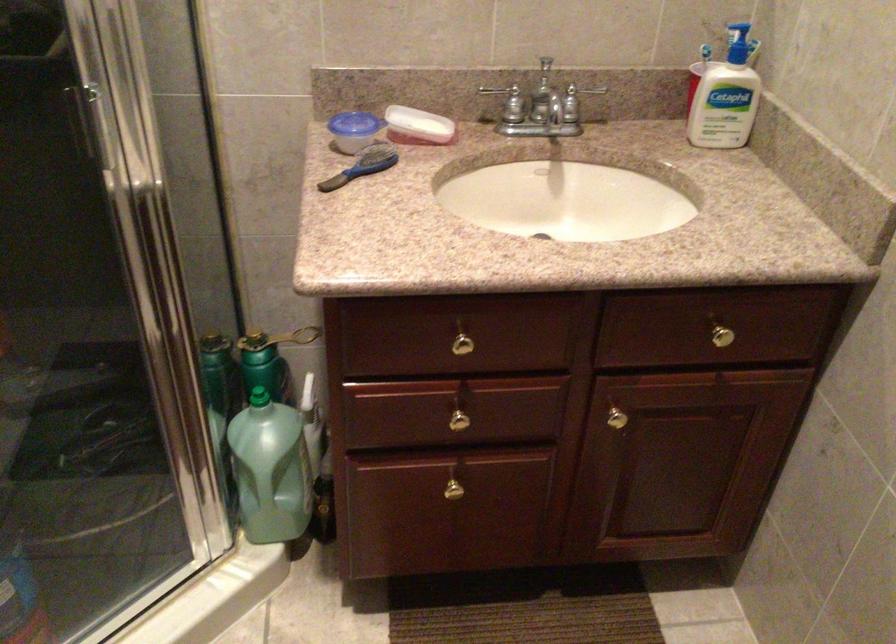
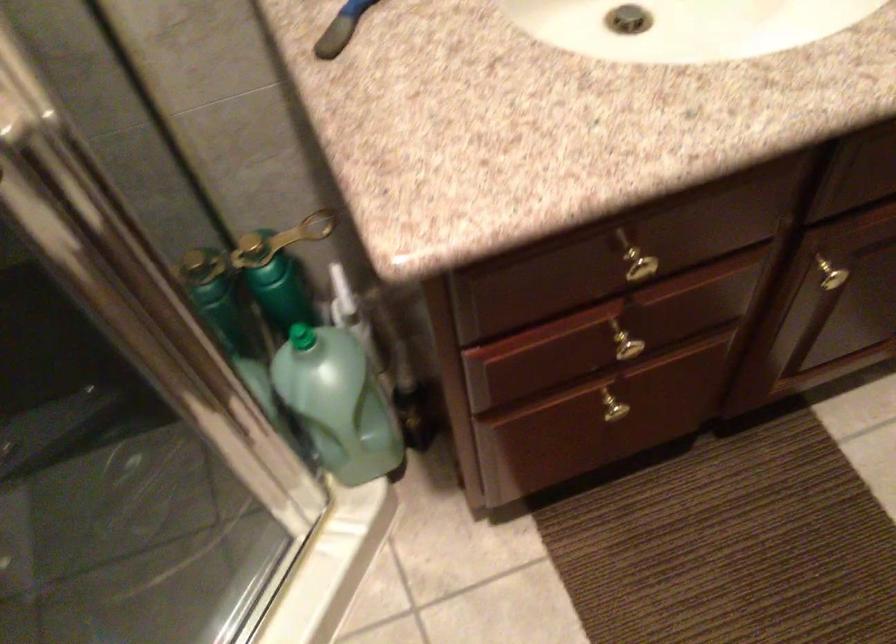
The point at (337, 178) is marked in the first image. Where is the corresponding point in the second image?

(340, 29)